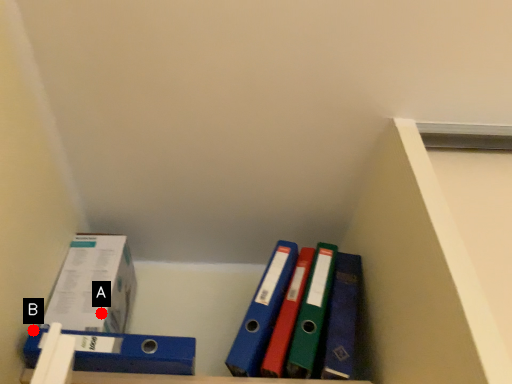
Question: Two points are circled on the image, labeled by A and B beside each circle. Which point appears closest to the camera in this image?

Choices:
 (A) A is closer
 (B) B is closer

Answer: (B)